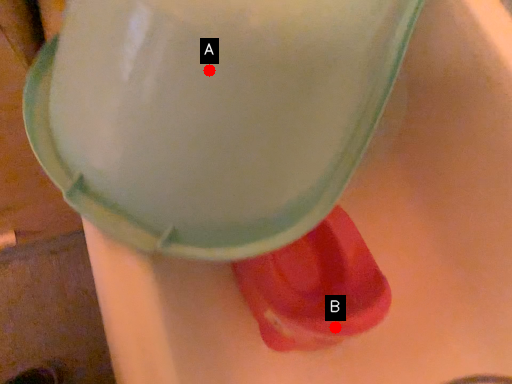
Question: Two points are circled on the image, labeled by A and B beside each circle. Which point is further to the camera?

Choices:
 (A) A is further
 (B) B is further

Answer: (B)